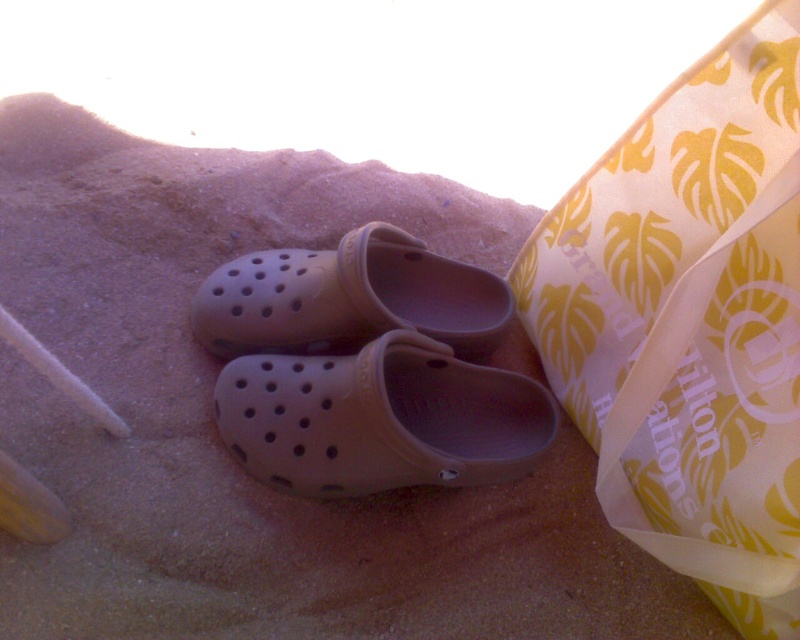
Question: Observing the image, what is the correct spatial positioning of tan rubber clog at center in reference to matte rubber clog at center?

Choices:
 (A) right
 (B) left

Answer: (A)

Question: Which of these objects is positioned closest to the tan rubber clog at center?

Choices:
 (A) matte rubber clog at center
 (B) white/yellow fabric at upper right

Answer: (A)

Question: Considering the relative positions of white/yellow fabric at upper right and tan rubber clog at center in the image provided, where is white/yellow fabric at upper right located with respect to tan rubber clog at center?

Choices:
 (A) left
 (B) right

Answer: (B)

Question: Is tan rubber clog at center positioned before matte rubber clog at center?

Choices:
 (A) no
 (B) yes

Answer: (B)

Question: Which point appears farthest from the camera in this image?

Choices:
 (A) (470, 273)
 (B) (385, 465)
 (C) (776, 141)

Answer: (A)

Question: Which is nearer to the matte rubber clog at center?

Choices:
 (A) white/yellow fabric at upper right
 (B) tan rubber clog at center

Answer: (B)